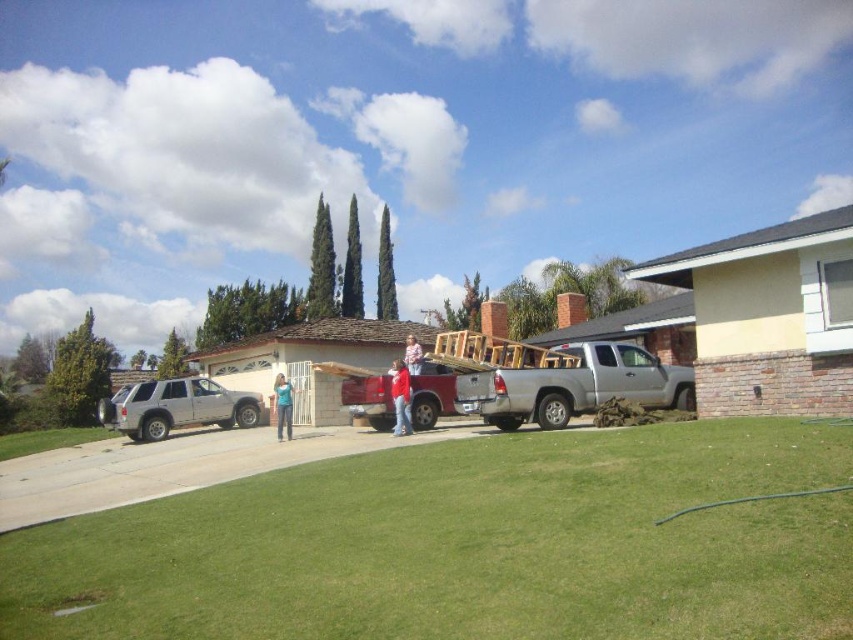
Question: Which point is closer to the camera taking this photo?

Choices:
 (A) (148, 413)
 (B) (630, 344)
 (C) (283, 419)

Answer: (B)

Question: From the image, what is the correct spatial relationship of green grass at center in relation to silver metallic suv at left?

Choices:
 (A) below
 (B) above

Answer: (B)

Question: Is green grass at center positioned before red matte shirt at center?

Choices:
 (A) yes
 (B) no

Answer: (A)

Question: Which of the following is the closest to the observer?

Choices:
 (A) red matte shirt at center
 (B) silver metallic suv at left

Answer: (A)

Question: Based on their relative distances, which object is farther from the green grass at center?

Choices:
 (A) silver metallic suv at left
 (B) red matte shirt at center

Answer: (A)

Question: Is green grass at center positioned before silver metallic pickup truck at center-right?

Choices:
 (A) no
 (B) yes

Answer: (B)